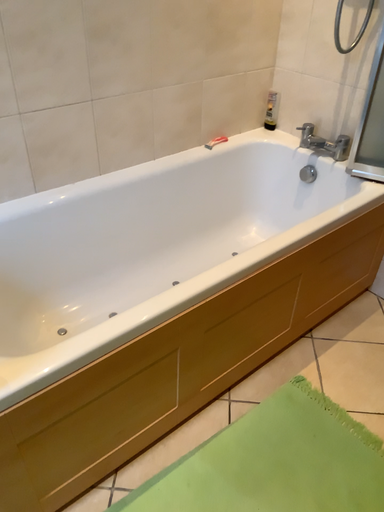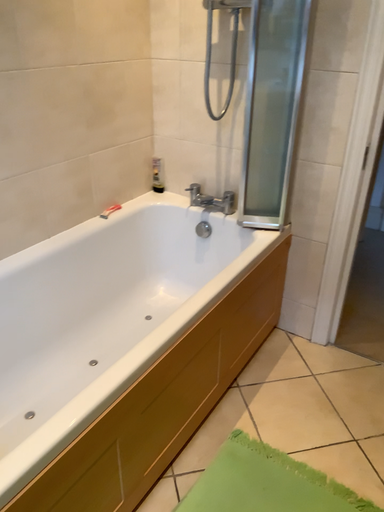
Question: How did the camera likely rotate when shooting the video?

Choices:
 (A) rotated left
 (B) rotated right

Answer: (B)